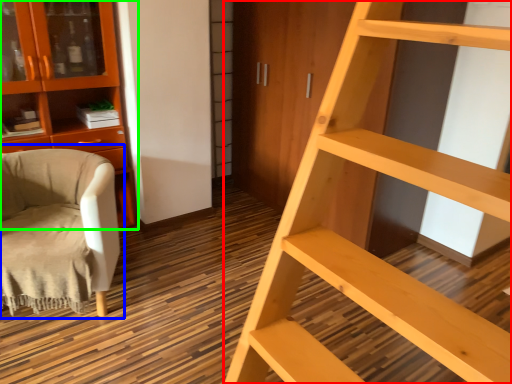
Question: Which object is the closest to the ladder (highlighted by a red box)? Choose among these: chair (highlighted by a blue box) or cabinetry (highlighted by a green box).

Choices:
 (A) chair
 (B) cabinetry

Answer: (A)